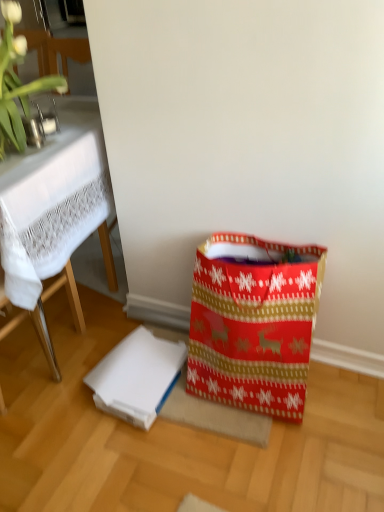
Question: Is white lace tablecloth at upper left at the back of white matte cardboard box at lower center?

Choices:
 (A) no
 (B) yes

Answer: (A)

Question: Is white matte cardboard box at lower center not inside white lace tablecloth at upper left?

Choices:
 (A) yes
 (B) no

Answer: (A)

Question: Is white matte cardboard box at lower center thinner than white lace tablecloth at upper left?

Choices:
 (A) no
 (B) yes

Answer: (B)

Question: From the image's perspective, is white matte cardboard box at lower center below white lace tablecloth at upper left?

Choices:
 (A) yes
 (B) no

Answer: (A)

Question: Considering the relative positions of white matte cardboard box at lower center and white lace tablecloth at upper left in the image provided, is white matte cardboard box at lower center to the left of white lace tablecloth at upper left from the viewer's perspective?

Choices:
 (A) yes
 (B) no

Answer: (B)

Question: Does white matte cardboard box at lower center have a larger size compared to white lace tablecloth at upper left?

Choices:
 (A) no
 (B) yes

Answer: (A)

Question: Is red paper shopping bag at lower right smaller than green leafy plant at upper left?

Choices:
 (A) no
 (B) yes

Answer: (A)

Question: Does red paper shopping bag at lower right turn towards green leafy plant at upper left?

Choices:
 (A) yes
 (B) no

Answer: (B)

Question: Is there a large distance between red paper shopping bag at lower right and green leafy plant at upper left?

Choices:
 (A) no
 (B) yes

Answer: (A)

Question: From the image's perspective, is red paper shopping bag at lower right on top of green leafy plant at upper left?

Choices:
 (A) no
 (B) yes

Answer: (A)

Question: Can you confirm if red paper shopping bag at lower right is taller than green leafy plant at upper left?

Choices:
 (A) yes
 (B) no

Answer: (A)

Question: Is red paper shopping bag at lower right outside green leafy plant at upper left?

Choices:
 (A) no
 (B) yes

Answer: (B)

Question: Are red paper shopping bag at lower right and white matte cardboard box at lower center far apart?

Choices:
 (A) no
 (B) yes

Answer: (A)